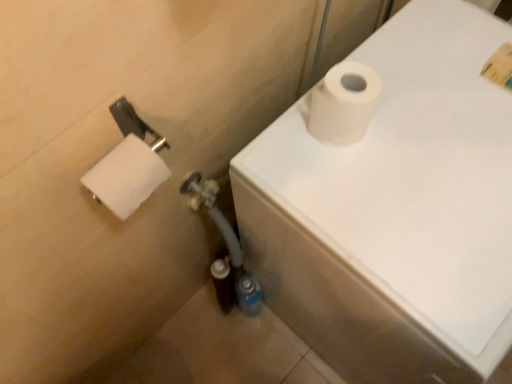
I want to click on empty space that is to the right of white matte toilet paper at upper right, acting as the first toilet paper starting from the right, so click(435, 123).